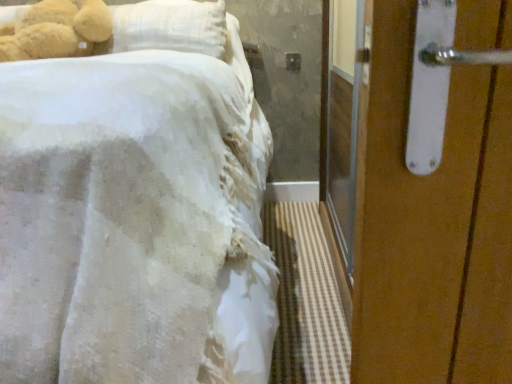
Question: Is white matte door handle at upper right at the right side of soft plush teddy bear at upper left?

Choices:
 (A) no
 (B) yes

Answer: (B)

Question: Can you confirm if white matte door handle at upper right is shorter than soft plush teddy bear at upper left?

Choices:
 (A) yes
 (B) no

Answer: (B)

Question: From a real-world perspective, is white matte door handle at upper right positioned under soft plush teddy bear at upper left based on gravity?

Choices:
 (A) yes
 (B) no

Answer: (A)

Question: Does white matte door handle at upper right have a greater width compared to soft plush teddy bear at upper left?

Choices:
 (A) no
 (B) yes

Answer: (B)

Question: Can you confirm if white matte door handle at upper right is bigger than soft plush teddy bear at upper left?

Choices:
 (A) yes
 (B) no

Answer: (A)

Question: Is white matte door handle at upper right placed right next to soft plush teddy bear at upper left?

Choices:
 (A) no
 (B) yes

Answer: (A)

Question: From the image's perspective, would you say soft plush teddy bear at upper left is positioned over white matte door handle at upper right?

Choices:
 (A) no
 (B) yes

Answer: (B)

Question: Is soft plush teddy bear at upper left at the right side of white matte door handle at upper right?

Choices:
 (A) no
 (B) yes

Answer: (A)

Question: From the image's perspective, is soft plush teddy bear at upper left beneath white matte door handle at upper right?

Choices:
 (A) yes
 (B) no

Answer: (B)

Question: Considering the relative sizes of soft plush teddy bear at upper left and white matte door handle at upper right in the image provided, is soft plush teddy bear at upper left taller than white matte door handle at upper right?

Choices:
 (A) yes
 (B) no

Answer: (B)

Question: Is soft plush teddy bear at upper left looking in the opposite direction of white matte door handle at upper right?

Choices:
 (A) yes
 (B) no

Answer: (B)

Question: Is soft plush teddy bear at upper left outside of white matte door handle at upper right?

Choices:
 (A) yes
 (B) no

Answer: (A)

Question: Is white fabric bed at left far from white matte door handle at upper right?

Choices:
 (A) yes
 (B) no

Answer: (B)